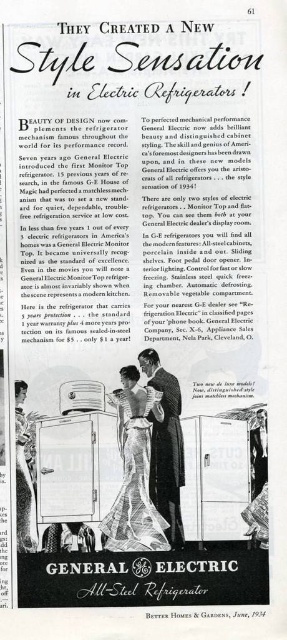
Question: Which object appears closest to the camera in this image?

Choices:
 (A) silky black suit at center
 (B) metallic silver trolley at center

Answer: (B)

Question: Is metallic silver trolley at center positioned before silky black suit at center?

Choices:
 (A) no
 (B) yes

Answer: (B)

Question: Among these objects, which one is nearest to the camera?

Choices:
 (A) metallic silver trolley at center
 (B) silky black suit at center

Answer: (A)

Question: Can you confirm if metallic silver trolley at center is thinner than silky black suit at center?

Choices:
 (A) no
 (B) yes

Answer: (A)

Question: Can you confirm if metallic silver trolley at center is positioned to the right of silky black suit at center?

Choices:
 (A) no
 (B) yes

Answer: (A)